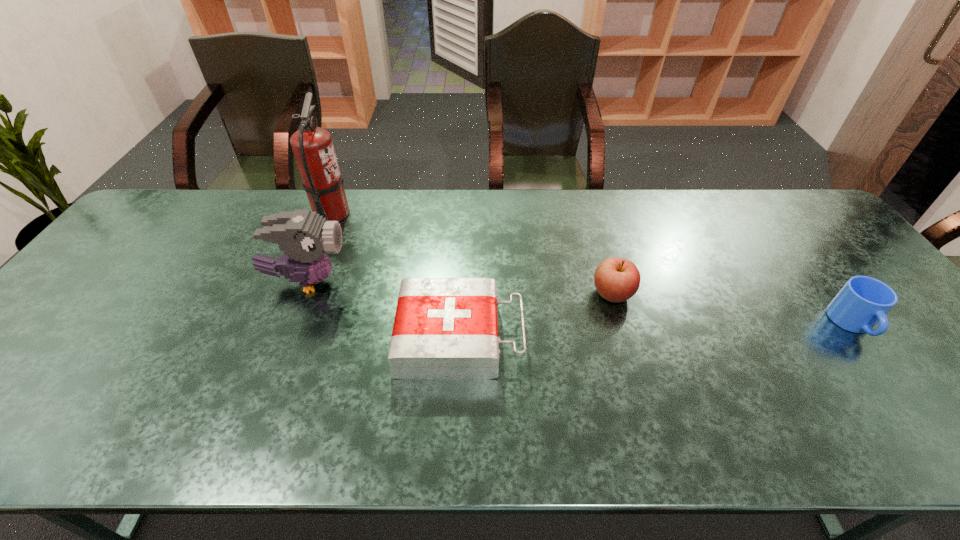
Where is `vacant region that satisfies the following two spatial constraints: 1. at the beak of the apple; 2. on the left side of the fourth shortest object`? The image size is (960, 540). vacant region that satisfies the following two spatial constraints: 1. at the beak of the apple; 2. on the left side of the fourth shortest object is located at coordinates (302, 294).